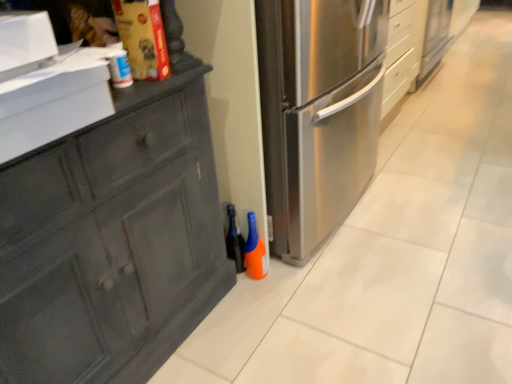
Question: Is orange matte bottle at lower center, which ranks as the second bottle in left-to-right order, in front of or behind translucent orange spray bottle at lower center, which is the first bottle from left to right, in the image?

Choices:
 (A) behind
 (B) front

Answer: (B)

Question: Is point (244, 253) positioned closer to the camera than point (237, 251)?

Choices:
 (A) closer
 (B) farther

Answer: (A)

Question: In terms of size, does orange matte bottle at lower center, which is the first bottle in right-to-left order, appear bigger or smaller than translucent orange spray bottle at lower center, the 2th bottle from the right?

Choices:
 (A) small
 (B) big

Answer: (A)

Question: From a real-world perspective, is translucent orange spray bottle at lower center, the 2th bottle from the right, above or below orange matte bottle at lower center, which is the first bottle in right-to-left order?

Choices:
 (A) above
 (B) below

Answer: (A)

Question: Based on their positions, is translucent orange spray bottle at lower center, which is the first bottle from left to right, located to the left or right of orange matte bottle at lower center, which is the first bottle in right-to-left order?

Choices:
 (A) right
 (B) left

Answer: (B)

Question: Does point (236, 266) appear closer or farther from the camera than point (260, 256)?

Choices:
 (A) closer
 (B) farther

Answer: (B)

Question: From the image's perspective, is translucent orange spray bottle at lower center, which is the first bottle from left to right, positioned above or below orange matte bottle at lower center, which ranks as the second bottle in left-to-right order?

Choices:
 (A) below
 (B) above

Answer: (B)